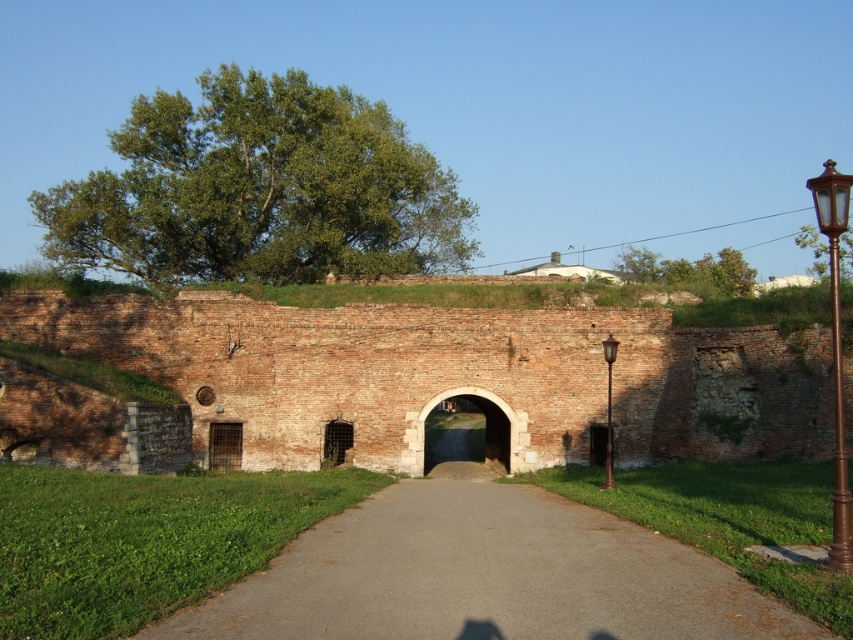
Question: Where is brown brick wall at center located in relation to gray asphalt path at center in the image?

Choices:
 (A) above
 (B) below

Answer: (A)

Question: Is brown polished metal lamp post at right above smooth stone archway at center?

Choices:
 (A) no
 (B) yes

Answer: (B)

Question: Which object is closer to the camera taking this photo?

Choices:
 (A) bronze/golden lamppost at right
 (B) brown brick wall at center
 (C) smooth stone archway at center
 (D) gray asphalt path at center

Answer: (D)

Question: Considering the real-world distances, which object is closest to the brown brick wall at center?

Choices:
 (A) bronze/golden lamppost at right
 (B) gray asphalt path at center

Answer: (A)

Question: Is brown polished metal lamp post at right thinner than smooth stone archway at center?

Choices:
 (A) yes
 (B) no

Answer: (B)

Question: Which object is positioned farthest from the gray asphalt path at center?

Choices:
 (A) brown polished metal lamp post at right
 (B) brown brick wall at center
 (C) smooth stone archway at center

Answer: (C)